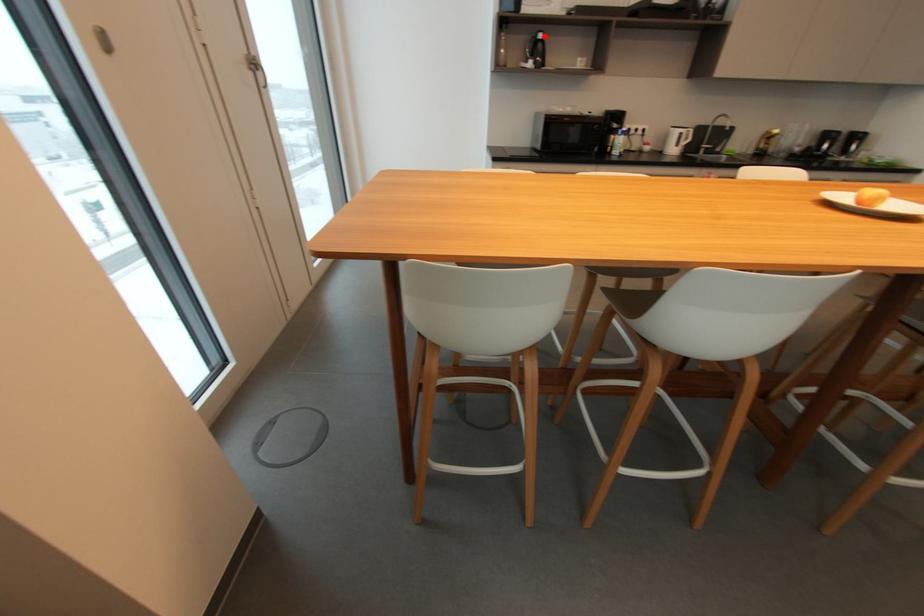
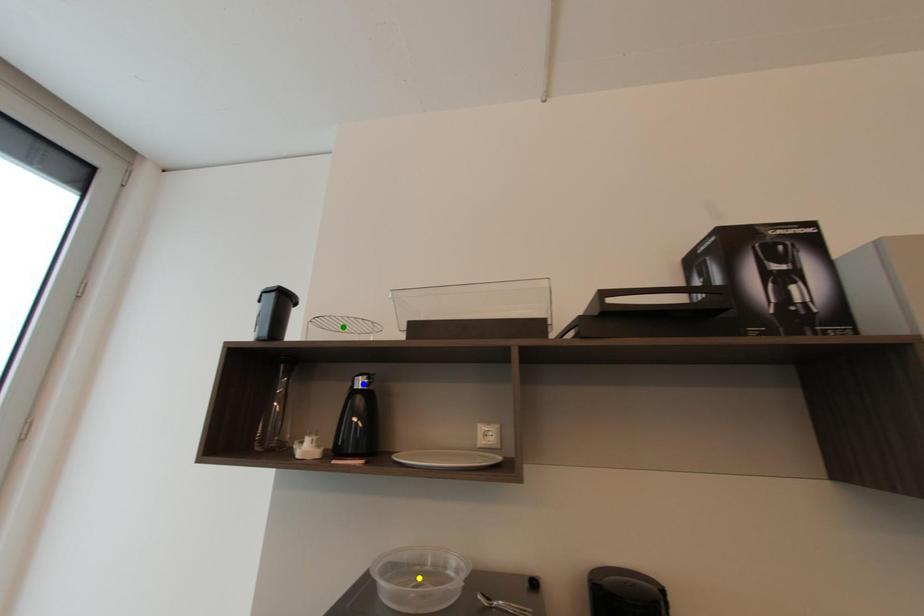
Question: I am providing you with two images of the same scene from different viewpoints. A red point is marked on the first image. You are given multiple points on the second image. Which point in image 2 represents the same 3d spot as the red point in image 1?

Choices:
 (A) yellow point
 (B) blue point
 (C) green point

Answer: (B)